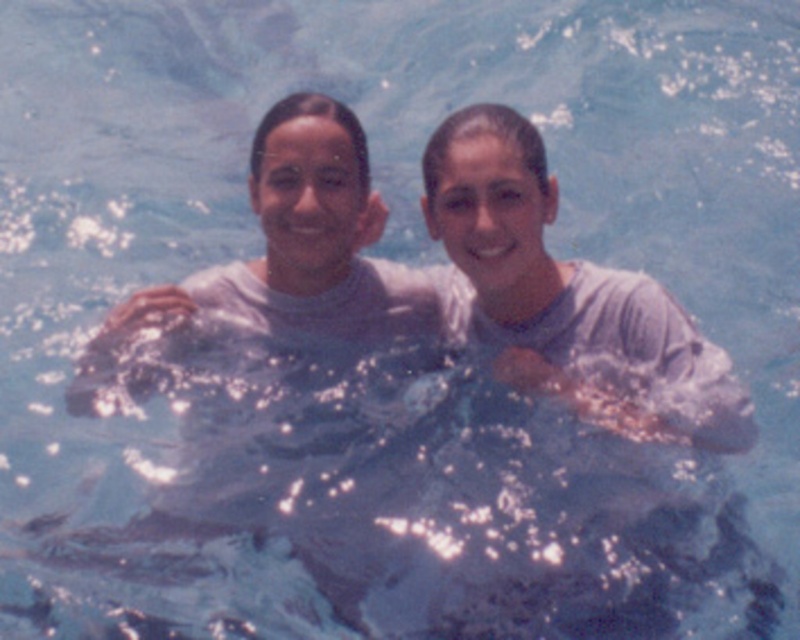
Question: Is white matte skin at center above matte gray shirt at center?

Choices:
 (A) yes
 (B) no

Answer: (A)

Question: Which point is farther from the camera taking this photo?

Choices:
 (A) (574, 406)
 (B) (476, 316)

Answer: (B)

Question: Which object appears closest to the camera in this image?

Choices:
 (A) gray matte shirt at center
 (B) white matte skin at center

Answer: (A)

Question: Can you confirm if white matte skin at center is positioned to the right of gray matte shirt at center?

Choices:
 (A) yes
 (B) no

Answer: (B)

Question: Observing the image, what is the correct spatial positioning of gray matte shirt at center in reference to matte gray shirt at center?

Choices:
 (A) above
 (B) below

Answer: (A)

Question: Which point is farther from the camera taking this photo?

Choices:
 (A) (218, 269)
 (B) (492, 241)
 (C) (462, 257)

Answer: (A)